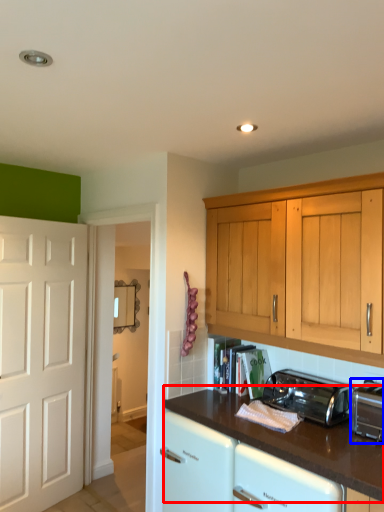
Question: Which of the following is the closest to the observer, countertop (highlighted by a red box) or toaster (highlighted by a blue box)?

Choices:
 (A) countertop
 (B) toaster

Answer: (A)